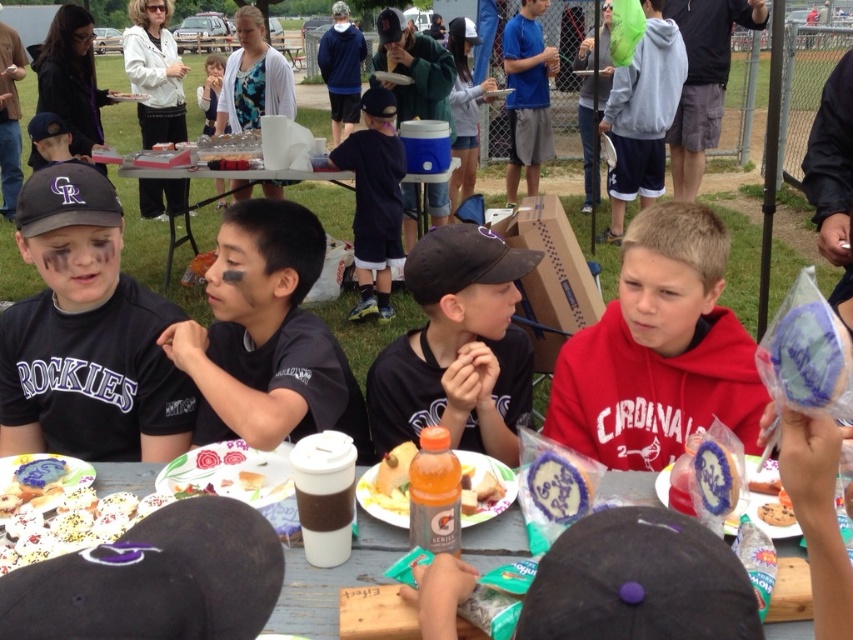
Question: Does black jersey at center have a lesser width compared to orange plastic bottle at center?

Choices:
 (A) yes
 (B) no

Answer: (B)

Question: Which point is closer to the camera?

Choices:
 (A) (64, 308)
 (B) (662, 362)

Answer: (B)

Question: Which object is closer to the camera taking this photo?

Choices:
 (A) chocolate chip cookie at center
 (B) black matte baseball cap at left

Answer: (A)

Question: Does black matte shirt at center have a larger size compared to wooden picnic table at center?

Choices:
 (A) no
 (B) yes

Answer: (B)

Question: Which of the following is the farthest from the observer?

Choices:
 (A) decorated cookie at center
 (B) black matte shirt at center
 (C) wooden picnic table at center

Answer: (B)

Question: In this image, where is decorated cookie at center located relative to white plastic table at center?

Choices:
 (A) right
 (B) left

Answer: (A)